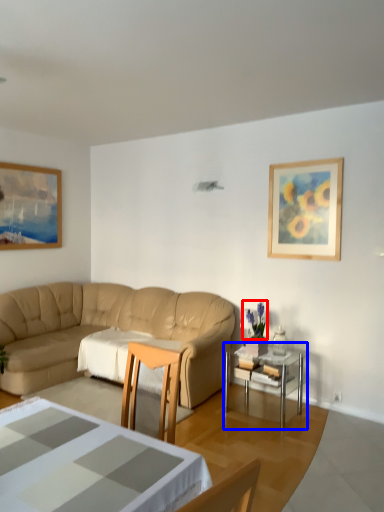
Question: Which object is further to the camera taking this photo, plant (highlighted by a red box) or table (highlighted by a blue box)?

Choices:
 (A) plant
 (B) table

Answer: (A)